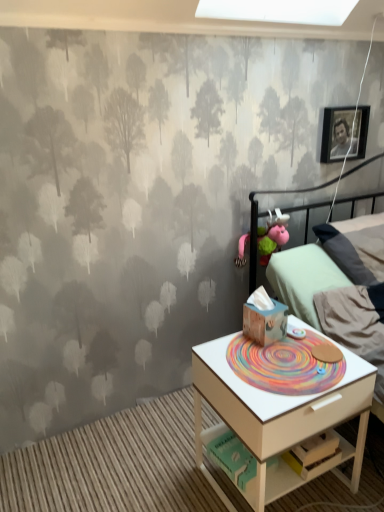
Identify the location of vacant area on top of white wood nightstand at lower right (from a real-world perspective). [x=285, y=357].